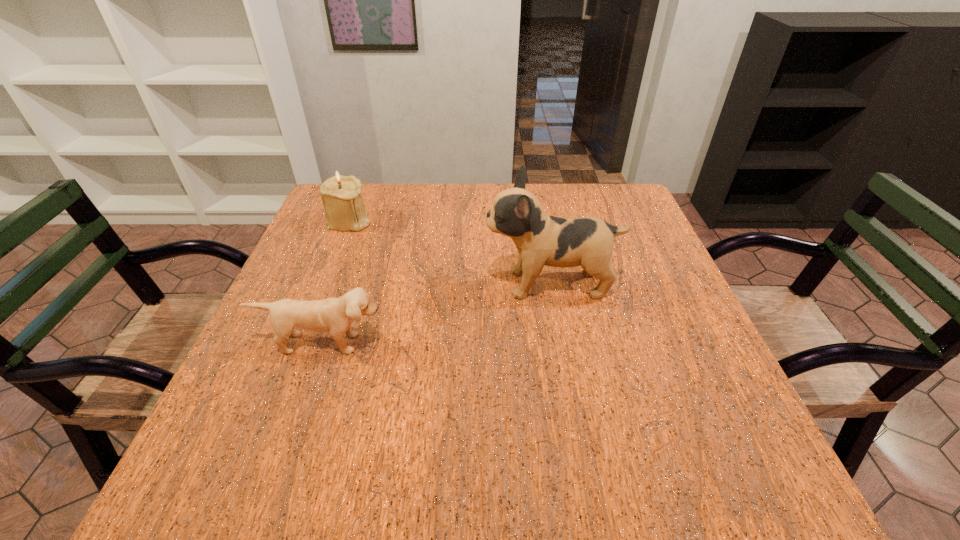
Where is `object that is at the far edge`? Image resolution: width=960 pixels, height=540 pixels. object that is at the far edge is located at coordinates pos(341,195).

Where is `candle_holder present at the left edge`? candle_holder present at the left edge is located at coordinates (341, 195).

At what (x,y) coordinates should I click in order to perform the action: click on puppy located in the left edge section of the desktop. Please return your answer as a coordinate pair (x, y). This screenshot has height=540, width=960. Looking at the image, I should click on (336, 315).

Identify the location of object that is at the right edge. Image resolution: width=960 pixels, height=540 pixels. (540, 239).

Locate an element on the screen. object that is at the far left corner is located at coordinates (341, 195).

What are the coordinates of `free space at the far edge` in the screenshot? It's located at (564, 198).

The width and height of the screenshot is (960, 540). In the image, there is a desktop. Identify the location of free space at the near edge. (590, 494).

In the image, there is a desktop. Where is `vacant space at the left edge`? The image size is (960, 540). vacant space at the left edge is located at coordinates (276, 293).

The image size is (960, 540). Find the location of `vacant region at the right edge`. vacant region at the right edge is located at coordinates (667, 379).

Identify the location of vacant space at the far left corner of the desktop. (317, 217).